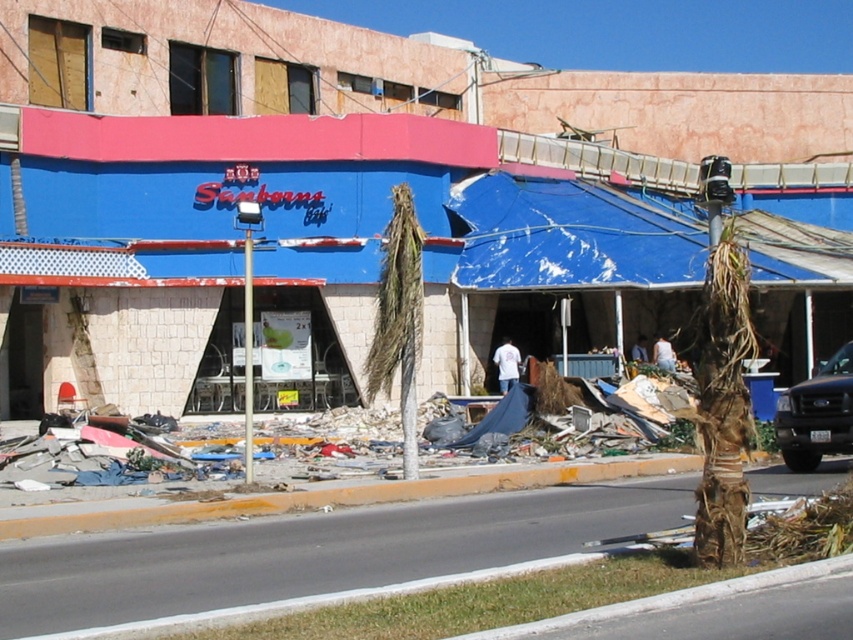
Question: From the image, what is the correct spatial relationship of blue tarpaulin awning at center in relation to black matte truck at right?

Choices:
 (A) left
 (B) right

Answer: (A)

Question: Is blue tarpaulin awning at center behind black matte truck at right?

Choices:
 (A) yes
 (B) no

Answer: (A)

Question: Is the position of blue tarpaulin awning at center more distant than that of black matte truck at right?

Choices:
 (A) yes
 (B) no

Answer: (A)